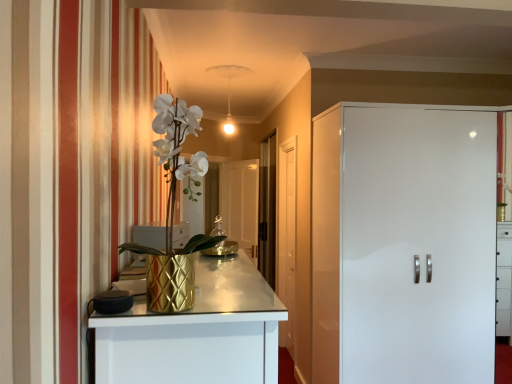
The image size is (512, 384). What do you see at coordinates (174, 210) in the screenshot?
I see `gold textured vase at left` at bounding box center [174, 210].

Locate an element on the screen. The height and width of the screenshot is (384, 512). transparent glass door at center, acting as the first glass door starting from the right is located at coordinates [x=267, y=209].

How much space does white glossy cabinet at right, positioned as the first door in front-to-back order, occupy horizontally?

white glossy cabinet at right, positioned as the first door in front-to-back order, is 25.55 inches in width.

The image size is (512, 384). In order to click on white wooden door at center, placed as the second door when sorted from right to left in this screenshot , I will do `click(286, 236)`.

This screenshot has height=384, width=512. Find the location of `gold textured vase at left`. gold textured vase at left is located at coordinates (174, 210).

Can you confirm if white wooden door at center, the second door from the front, is wider than transparent glass door at center, the 1th glass door positioned from the left?

Incorrect, the width of white wooden door at center, the second door from the front, does not surpass that of transparent glass door at center, the 1th glass door positioned from the left.

Is the depth of white wooden door at center, which is the first door from left to right, greater than that of transparent glass door at center, the 1th glass door positioned from the left?

No, white wooden door at center, which is the first door from left to right, is in front of transparent glass door at center, the 1th glass door positioned from the left.

From the image's perspective, is white wooden door at center, the second door from the front, positioned above or below transparent glass door at center, the second glass door in the right-to-left sequence?

white wooden door at center, the second door from the front, is situated higher than transparent glass door at center, the second glass door in the right-to-left sequence, in the image.

Consider the image. How distant is white wooden door at center, which is the first door from left to right, from transparent glass door at center, the second glass door in the right-to-left sequence?

white wooden door at center, which is the first door from left to right, is 5.37 feet from transparent glass door at center, the second glass door in the right-to-left sequence.

Which point is more forward, (x=467, y=275) or (x=250, y=247)?

The point (x=467, y=275) is more forward.

In the scene shown: From the image's perspective, between white glossy cabinet at right, the 2th door positioned from the left, and transparent glass door at center, the 1th glass door positioned from the left, which one is located above?

white glossy cabinet at right, the 2th door positioned from the left, appears higher in the image.

From a real-world perspective, does white glossy cabinet at right, positioned as the first door in front-to-back order, sit lower than transparent glass door at center, the second glass door in the right-to-left sequence?

No.

Which is more to the right, white wooden door at center, the second door from the front, or white glossy cabinet at right, the 1th door from the right?

white glossy cabinet at right, the 1th door from the right, is more to the right.

Can you confirm if white wooden door at center, which is the first door from left to right, is shorter than white glossy cabinet at right, positioned as the first door in front-to-back order?

Incorrect, the height of white wooden door at center, which is the first door from left to right, does not fall short of that of white glossy cabinet at right, positioned as the first door in front-to-back order.

Is white wooden door at center, the second door from the front, smaller than white glossy cabinet at right, positioned as the first door in front-to-back order?

Indeed, white wooden door at center, the second door from the front, has a smaller size compared to white glossy cabinet at right, positioned as the first door in front-to-back order.

From the image's perspective, is white wooden door at center, which is the first door from left to right, above white glossy cabinet at right, which appears as the 2th door when viewed from the back?

No, from the image's perspective, white wooden door at center, which is the first door from left to right, is not over white glossy cabinet at right, which appears as the 2th door when viewed from the back.

In terms of width, does transparent glass door at center, the second glass door in the right-to-left sequence, look wider or thinner when compared to white wooden door at center, placed as the second door when sorted from right to left?

In the image, transparent glass door at center, the second glass door in the right-to-left sequence, appears to be wider than white wooden door at center, placed as the second door when sorted from right to left.

Is transparent glass door at center, the second glass door in the right-to-left sequence, inside the boundaries of white wooden door at center, placed as the second door when sorted from right to left, or outside?

transparent glass door at center, the second glass door in the right-to-left sequence, is not enclosed by white wooden door at center, placed as the second door when sorted from right to left.

From the image's perspective, does transparent glass door at center, the second glass door in the right-to-left sequence, appear lower than white wooden door at center, the second door from the front?

Indeed, from the image's perspective, transparent glass door at center, the second glass door in the right-to-left sequence, is shown beneath white wooden door at center, the second door from the front.

Considering the relative sizes of white glossy cabinet at right, positioned as the first door in front-to-back order, and white wooden door at center, the second door from the front, in the image provided, is white glossy cabinet at right, positioned as the first door in front-to-back order, wider than white wooden door at center, the second door from the front,?

Indeed, white glossy cabinet at right, positioned as the first door in front-to-back order, has a greater width compared to white wooden door at center, the second door from the front.

Considering the sizes of objects white glossy cabinet at right, the 1th door from the right, and white wooden door at center, the second door from the front, in the image provided, who is smaller, white glossy cabinet at right, the 1th door from the right, or white wooden door at center, the second door from the front,?

Smaller between the two is white wooden door at center, the second door from the front.

Could white wooden door at center, which is the first door from left to right, be considered to be inside white glossy cabinet at right, the 1th door from the right?

No, white wooden door at center, which is the first door from left to right, is not a part of white glossy cabinet at right, the 1th door from the right.

From the image's perspective, which object appears higher, white glossy cabinet at right, the 1th door from the right, or white wooden door at center, which appears as the first door when viewed from the back?

white glossy cabinet at right, the 1th door from the right.

Does transparent glass door at center, acting as the first glass door starting from the right, appear on the left side of white glossy cabinet at right, the 2th door positioned from the left?

Indeed, transparent glass door at center, acting as the first glass door starting from the right, is positioned on the left side of white glossy cabinet at right, the 2th door positioned from the left.

How different are the orientations of transparent glass door at center, acting as the first glass door starting from the right, and white glossy cabinet at right, positioned as the first door in front-to-back order, in degrees?

The angular difference between transparent glass door at center, acting as the first glass door starting from the right, and white glossy cabinet at right, positioned as the first door in front-to-back order, is 90.2 degrees.

Is transparent glass door at center, acting as the first glass door starting from the right, beside white glossy cabinet at right, which appears as the 2th door when viewed from the back?

transparent glass door at center, acting as the first glass door starting from the right, and white glossy cabinet at right, which appears as the 2th door when viewed from the back, are not in contact.

From the image's perspective, is transparent glass door at center, which is counted as the second glass door, starting from the left, on top of white glossy cabinet at right, which appears as the 2th door when viewed from the back?

Correct, transparent glass door at center, which is counted as the second glass door, starting from the left, appears higher than white glossy cabinet at right, which appears as the 2th door when viewed from the back, in the image.

Considering the positions of objects white wooden door at center, placed as the second door when sorted from right to left, and gold textured vase at left in the image provided, who is behind, white wooden door at center, placed as the second door when sorted from right to left, or gold textured vase at left?

white wooden door at center, placed as the second door when sorted from right to left, is behind.

Which is less distant, (279, 214) or (147, 282)?

Point (279, 214) is positioned farther from the camera compared to point (147, 282).

Where is `door that is the 1st object above the transparent glass door at center, the 1th glass door positioned from the left (from a real-world perspective)`? The height and width of the screenshot is (384, 512). door that is the 1st object above the transparent glass door at center, the 1th glass door positioned from the left (from a real-world perspective) is located at coordinates (286, 236).

Locate an element on the screen. glass door lying below the white glossy cabinet at right, the 2th door positioned from the left (from the image's perspective) is located at coordinates (240, 203).

From the image, which object appears to be nearer to gold textured vase at left, transparent glass door at center, the second glass door in the right-to-left sequence, or white wooden door at center, the second door from the front?

white wooden door at center, the second door from the front, is positioned closer to the anchor gold textured vase at left.

In the scene shown: From the image, which object appears to be nearer to white wooden door at center, which is the first door from left to right, transparent glass door at center, the 1th glass door positioned from the left, or transparent glass door at center, acting as the first glass door starting from the right?

transparent glass door at center, acting as the first glass door starting from the right, lies closer to white wooden door at center, which is the first door from left to right, than the other object.

When comparing their distances from white glossy cabinet at right, which appears as the 2th door when viewed from the back, does gold textured vase at left or transparent glass door at center, the second glass door in the right-to-left sequence, seem further?

transparent glass door at center, the second glass door in the right-to-left sequence, is further to white glossy cabinet at right, which appears as the 2th door when viewed from the back.

Looking at this image, from the image, which object appears to be nearer to gold textured vase at left, transparent glass door at center, the 1th glass door positioned from the left, or transparent glass door at center, acting as the first glass door starting from the right?

transparent glass door at center, acting as the first glass door starting from the right.

From the image, which object appears to be nearer to white glossy cabinet at right, positioned as the first door in front-to-back order, transparent glass door at center, the second glass door in the right-to-left sequence, or transparent glass door at center, acting as the first glass door starting from the right?

The object closer to white glossy cabinet at right, positioned as the first door in front-to-back order, is transparent glass door at center, acting as the first glass door starting from the right.

From the image, which object appears to be nearer to gold textured vase at left, white wooden door at center, placed as the second door when sorted from right to left, or white glossy cabinet at right, the 1th door from the right?

The object closer to gold textured vase at left is white glossy cabinet at right, the 1th door from the right.

Based on their spatial positions, is transparent glass door at center, the second glass door in the right-to-left sequence, or white glossy cabinet at right, the 2th door positioned from the left, further from white wooden door at center, which appears as the first door when viewed from the back?

transparent glass door at center, the second glass door in the right-to-left sequence, is further to white wooden door at center, which appears as the first door when viewed from the back.

Considering their positions, is transparent glass door at center, which is counted as the second glass door, starting from the left, positioned closer to transparent glass door at center, the second glass door in the right-to-left sequence, than gold textured vase at left?

transparent glass door at center, which is counted as the second glass door, starting from the left, is closer to transparent glass door at center, the second glass door in the right-to-left sequence.

You are a GUI agent. You are given a task and a screenshot of the screen. Output one action in this format:
    pyautogui.click(x=<x>, y=<y>)
    Task: Click on the glass door located between gold textured vase at left and transparent glass door at center, the second glass door in the right-to-left sequence, in the depth direction
    
    Given the screenshot: What is the action you would take?
    pyautogui.click(x=267, y=209)

The width and height of the screenshot is (512, 384). What are the coordinates of `door positioned between gold textured vase at left and white wooden door at center, which appears as the first door when viewed from the back, from near to far` in the screenshot? It's located at (404, 243).

Where is `glass door between white wooden door at center, placed as the second door when sorted from right to left, and transparent glass door at center, the 1th glass door positioned from the left, from front to back`? This screenshot has height=384, width=512. glass door between white wooden door at center, placed as the second door when sorted from right to left, and transparent glass door at center, the 1th glass door positioned from the left, from front to back is located at coordinates (267, 209).

Find the location of a particular element. The width and height of the screenshot is (512, 384). door between white glossy cabinet at right, which appears as the 2th door when viewed from the back, and transparent glass door at center, the 1th glass door positioned from the left, from front to back is located at coordinates click(x=286, y=236).